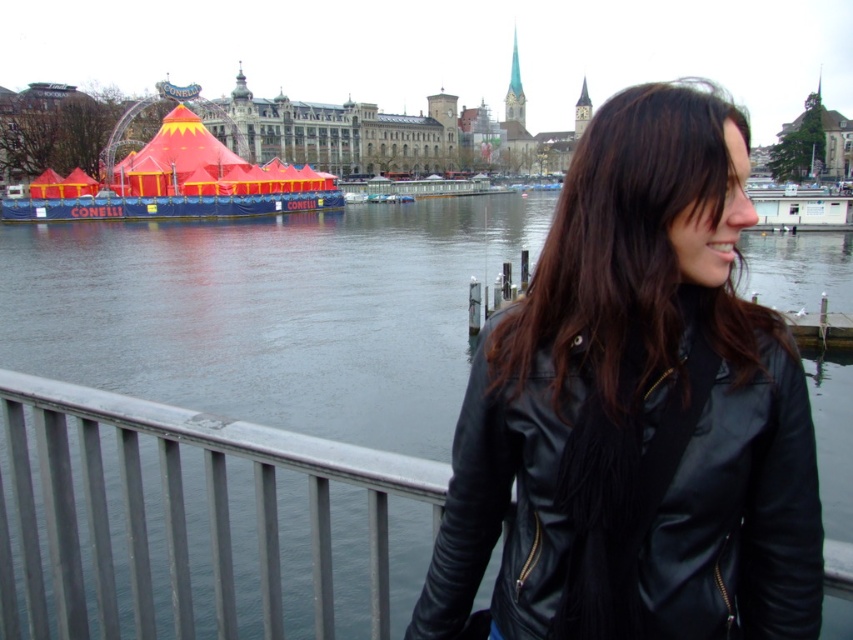
You are standing on the waterfront and want to take a photo of both the dark blue water at center and the black leather jacket at right. Which object should you focus on first to ensure both are in clear view?

You should focus on the black leather jacket at right first because it is closer to you than the dark blue water at center, ensuring both are in clear view.

What are the coordinates of the black leather jacket at center?

The coordinates of the black leather jacket at center are at point (636, 410).